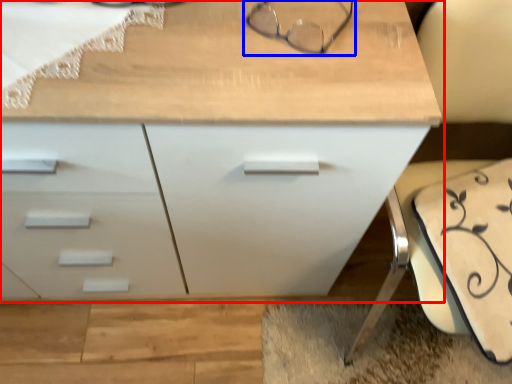
Question: Among these objects, which one is nearest to the camera, chest of drawers (highlighted by a red box) or glasses (highlighted by a blue box)?

Choices:
 (A) chest of drawers
 (B) glasses

Answer: (A)